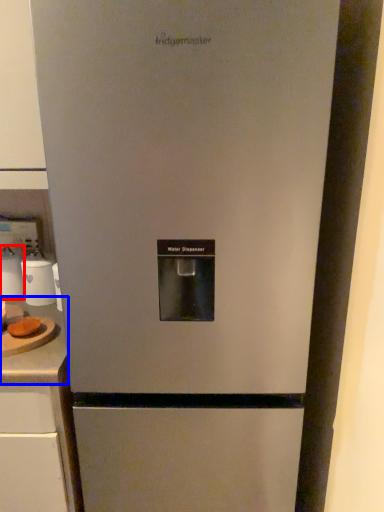
Question: Which of the following is the farthest to the observer, appliance (highlighted by a red box) or counter top (highlighted by a blue box)?

Choices:
 (A) appliance
 (B) counter top

Answer: (A)